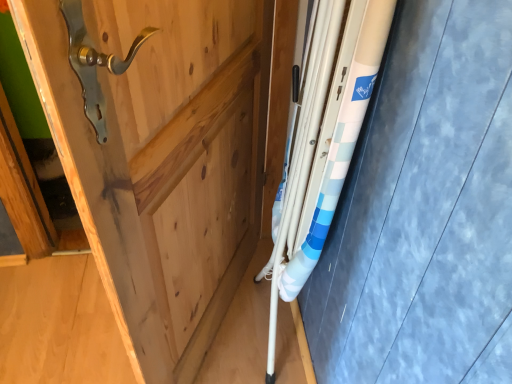
At what (x,y) coordinates should I click in order to perform the action: click on natural wood door at center. Please return your answer as a coordinate pair (x, y). Looking at the image, I should click on (161, 158).

Describe the element at coordinates (161, 158) in the screenshot. I see `natural wood door at center` at that location.

From the picture: Measure the distance between point [249,213] and camera.

The distance of point [249,213] from camera is 4.76 feet.

You are a GUI agent. You are given a task and a screenshot of the screen. Output one action in this format:
    pyautogui.click(x=<x>, y=<y>)
    Task: Click on the natural wood door at center
    The height and width of the screenshot is (384, 512).
    Given the screenshot: What is the action you would take?
    (x=161, y=158)